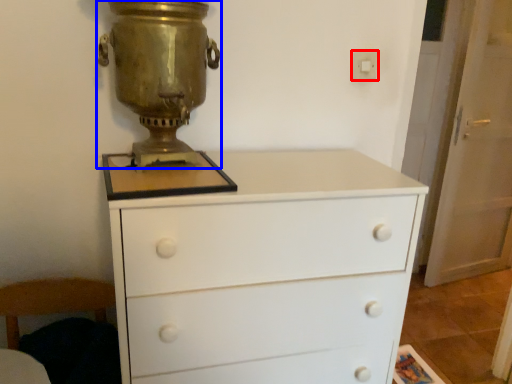
Question: Among these objects, which one is nearest to the camera, electric outlet (highlighted by a red box) or candle holder (highlighted by a blue box)?

Choices:
 (A) electric outlet
 (B) candle holder

Answer: (B)